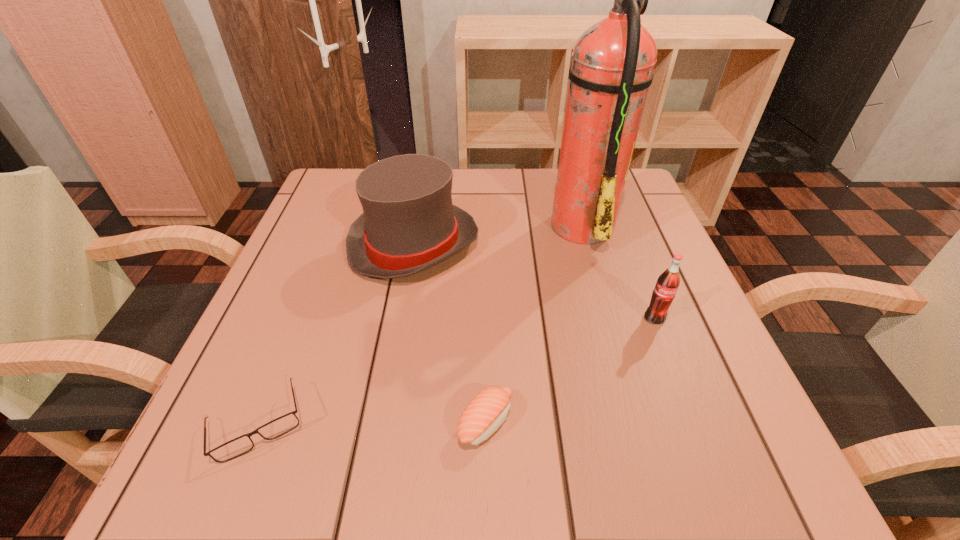
Where is `object located at the near left corner`? object located at the near left corner is located at coordinates (232, 449).

Identify the location of object that is positioned at the far right corner. This screenshot has width=960, height=540. (612, 66).

In order to click on vacant region at the far edge of the desktop in this screenshot , I will do `click(469, 191)`.

This screenshot has width=960, height=540. Identify the location of free space at the near edge of the desktop. (588, 490).

Find the location of `vacant area at the left edge of the desktop`. vacant area at the left edge of the desktop is located at coordinates (263, 301).

I want to click on free space at the right edge of the desktop, so click(632, 266).

The width and height of the screenshot is (960, 540). In the image, there is a desktop. Identify the location of vacant space at the far left corner. (331, 194).

This screenshot has height=540, width=960. Identify the location of free space at the near left corner of the desktop. (221, 435).

You are a GUI agent. You are given a task and a screenshot of the screen. Output one action in this format:
    pyautogui.click(x=<x>, y=<y>)
    Task: Click on the free space at the near right corner of the desktop
    Image resolution: width=960 pixels, height=540 pixels.
    Given the screenshot: What is the action you would take?
    pyautogui.click(x=724, y=478)

This screenshot has height=540, width=960. I want to click on free space between the dress hat and the tallest object, so click(498, 234).